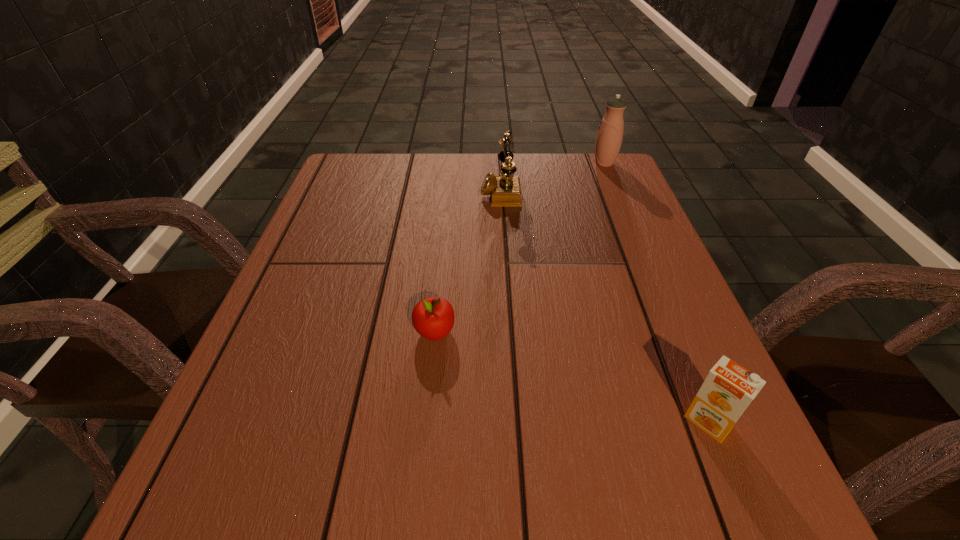
You are a GUI agent. You are given a task and a screenshot of the screen. Output one action in this format:
    pyautogui.click(x=<x>, y=<y>)
    Task: Click on the thermos bottle
    The image size is (960, 540).
    Given the screenshot: What is the action you would take?
    pyautogui.click(x=609, y=138)

Find the location of a particular element. The width and height of the screenshot is (960, 540). the farthest object is located at coordinates (609, 138).

In order to click on telephone in this screenshot , I will do `click(505, 191)`.

Locate an element on the screen. the third nearest object is located at coordinates (505, 191).

The width and height of the screenshot is (960, 540). I want to click on orange juice, so click(729, 388).

Locate an element on the screen. the second shortest object is located at coordinates (729, 388).

The height and width of the screenshot is (540, 960). Find the location of `the second nearest object`. the second nearest object is located at coordinates (433, 318).

You are a GUI agent. You are given a task and a screenshot of the screen. Output one action in this format:
    pyautogui.click(x=<x>, y=<y>)
    Task: Click on the shortest object
    The height and width of the screenshot is (540, 960).
    Given the screenshot: What is the action you would take?
    pyautogui.click(x=433, y=318)

Where is `blank space located on the front of the thermos bottle`? The image size is (960, 540). blank space located on the front of the thermos bottle is located at coordinates (628, 221).

Identify the location of free space located on the dial number of the telephone. (420, 191).